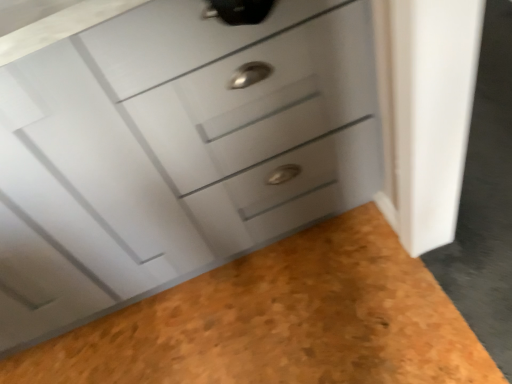
What do you see at coordinates (174, 151) in the screenshot? The image size is (512, 384). I see `white glossy chest of drawers at center` at bounding box center [174, 151].

What are the coordinates of `white glossy chest of drawers at center` in the screenshot? It's located at (174, 151).

Locate an element on the screen. This screenshot has height=384, width=512. white glossy chest of drawers at center is located at coordinates (x=174, y=151).